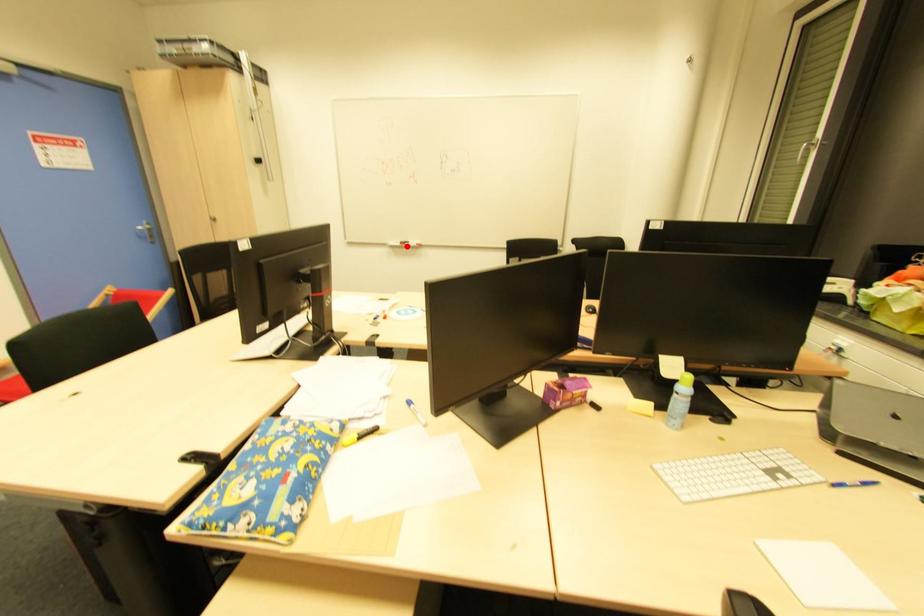
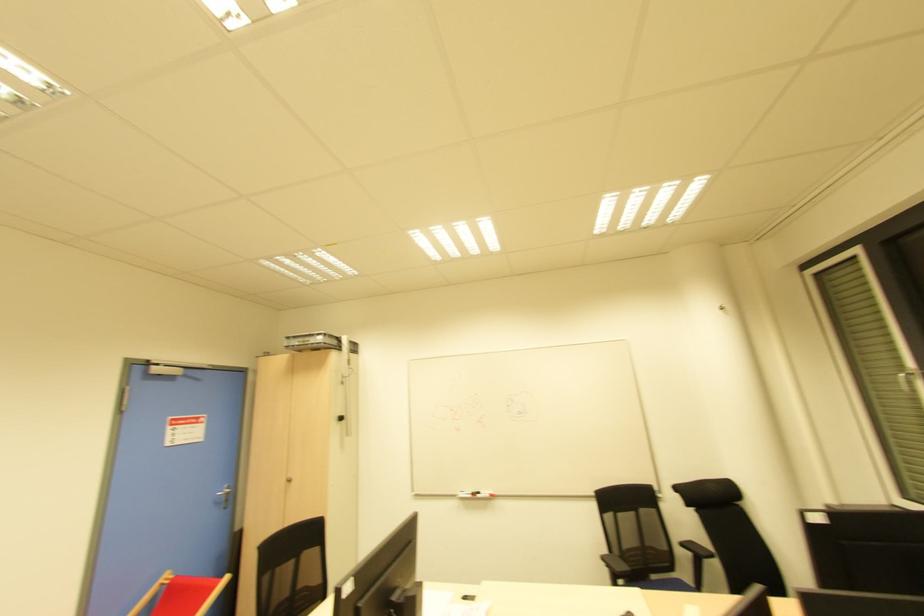
Question: I am providing you with two images of the same scene from different viewpoints. A red point is marked on the first image. Is the red point's position out of view in image 2?

Choices:
 (A) Yes
 (B) No

Answer: (B)